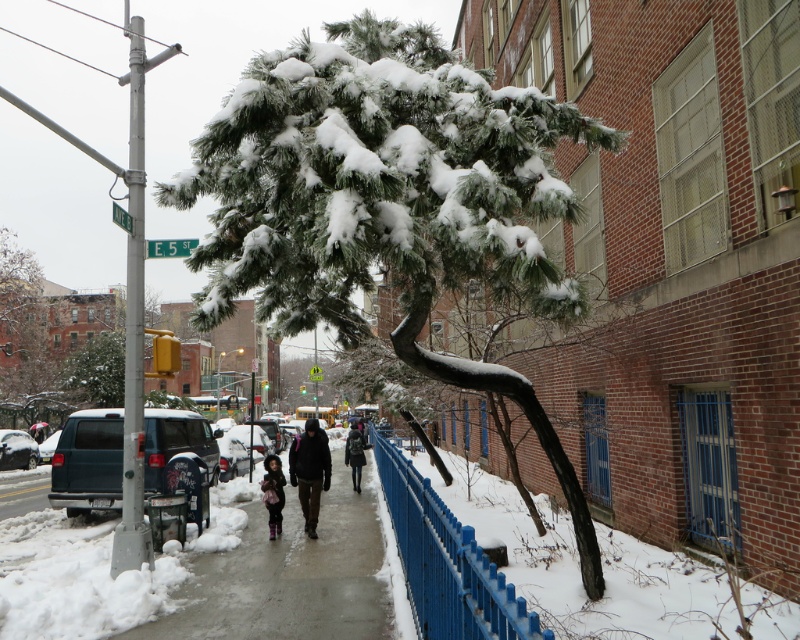
Question: Which of the following is the farthest from the observer?

Choices:
 (A) smooth concrete sidewalk at center
 (B) blue metal fence at lower right
 (C) dark brown fur coat at center

Answer: (C)

Question: Which object appears closest to the camera in this image?

Choices:
 (A) dark brown leather jacket at center
 (B) dark gray fabric coat at center
 (C) blue metal fence at lower right
 (D) green snow-covered tree at center

Answer: (C)

Question: Does blue metal fence at lower right appear on the left side of dark brown leather jacket at center?

Choices:
 (A) yes
 (B) no

Answer: (B)

Question: Is blue metal fence at lower right above dark brown fur coat at center?

Choices:
 (A) no
 (B) yes

Answer: (A)

Question: From the image, what is the correct spatial relationship of green snow-covered tree at center in relation to dark gray fabric coat at center?

Choices:
 (A) right
 (B) left

Answer: (A)

Question: Which object is positioned closest to the green snow-covered tree at center?

Choices:
 (A) dark gray fabric coat at center
 (B) dark brown leather jacket at center
 (C) dark brown fur coat at center
 (D) smooth concrete sidewalk at center

Answer: (D)